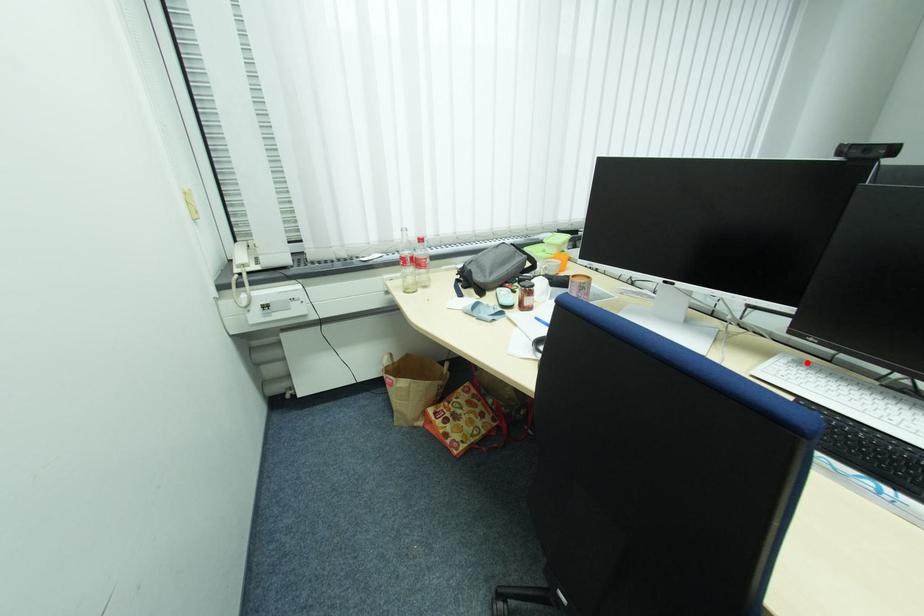
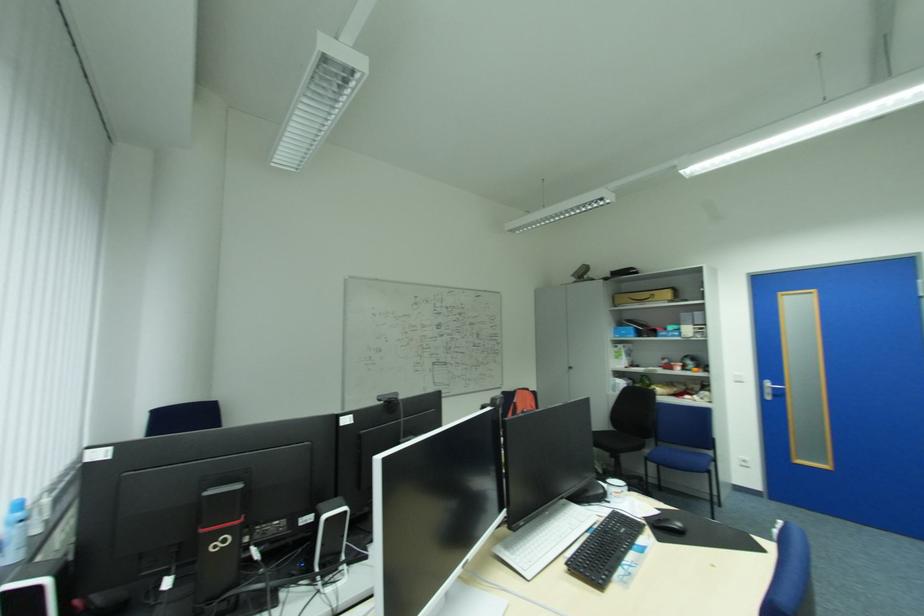
In the second image, find the point that corresponds to the highlighted location in the first image.

(514, 546)